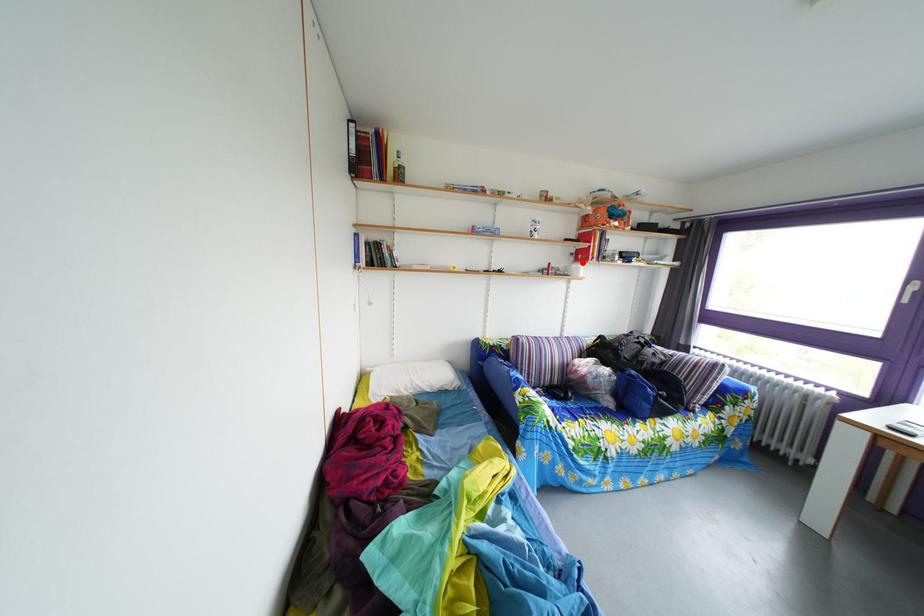
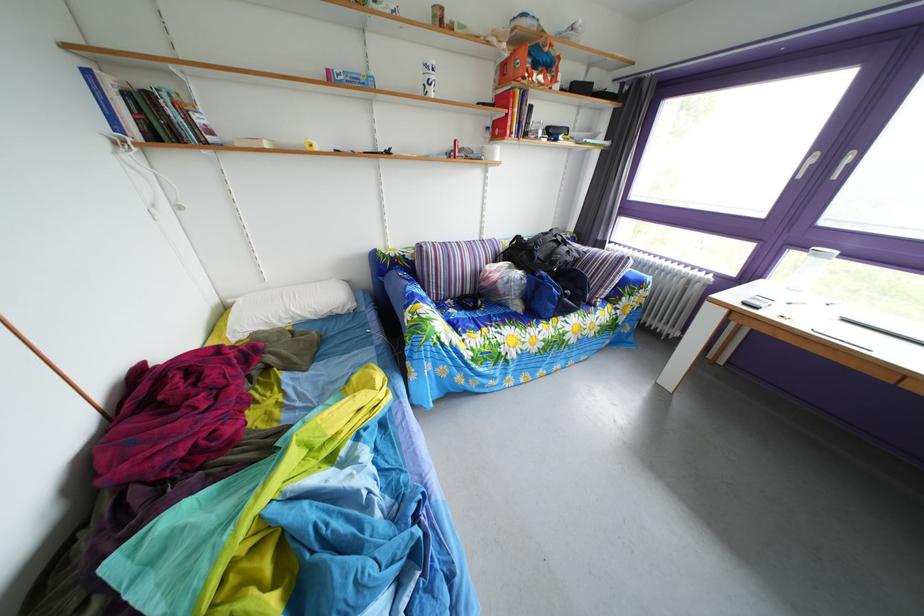
Locate, in the second image, the point that corresponds to the highlighted location in the first image.

(499, 137)